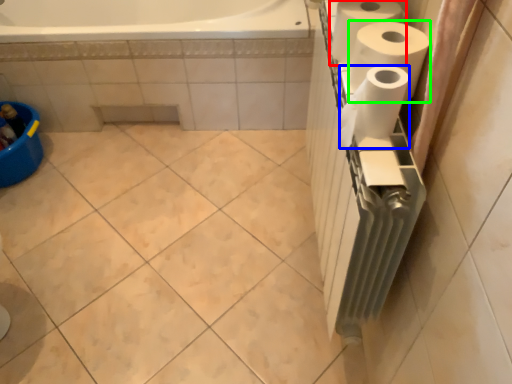
Question: Which object is positioned closest to paper towel (highlighted by a red box)? Select from paper towel (highlighted by a blue box) and paper towel (highlighted by a green box).

Choices:
 (A) paper towel
 (B) paper towel

Answer: (B)